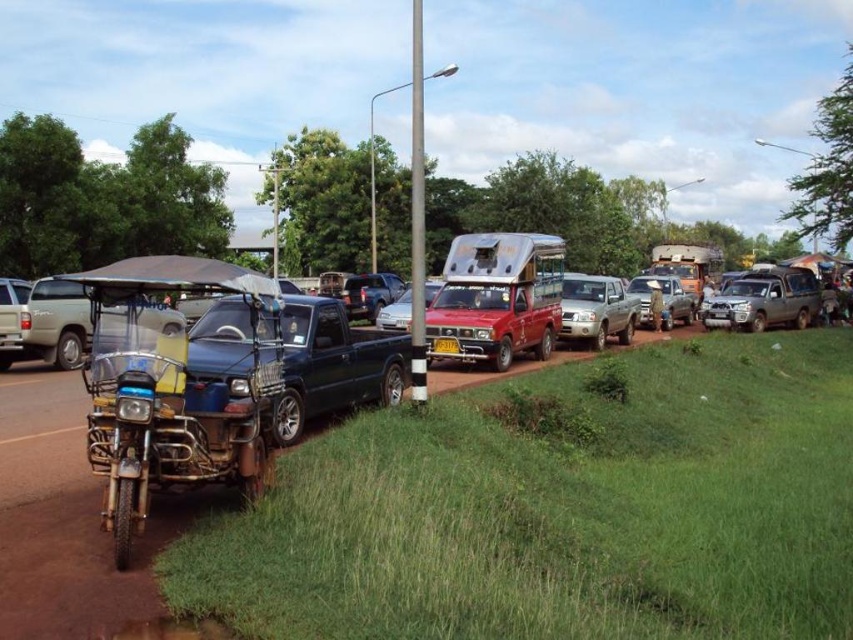
Question: Does satin silver sedan at center appear over yellow plastic license plate at center?

Choices:
 (A) yes
 (B) no

Answer: (A)

Question: Among these points, which one is farthest from the camera?

Choices:
 (A) (672, 305)
 (B) (602, 321)
 (C) (331, 374)
 (D) (433, 282)

Answer: (A)

Question: Does silver metallic pickup truck at center appear on the right side of metallic motorcycle at lower left?

Choices:
 (A) no
 (B) yes

Answer: (B)

Question: Which of the following is the closest to the observer?

Choices:
 (A) silver metallic suv at right
 (B) satin silver sedan at center

Answer: (B)

Question: Estimate the real-world distances between objects in this image. Which object is farther from the yellow plastic license plate at center?

Choices:
 (A) silver metallic suv at right
 (B) metallic blue pickup truck at center

Answer: (A)

Question: Can you confirm if metallic motorcycle at lower left is wider than yellow plastic license plate at center?

Choices:
 (A) no
 (B) yes

Answer: (B)